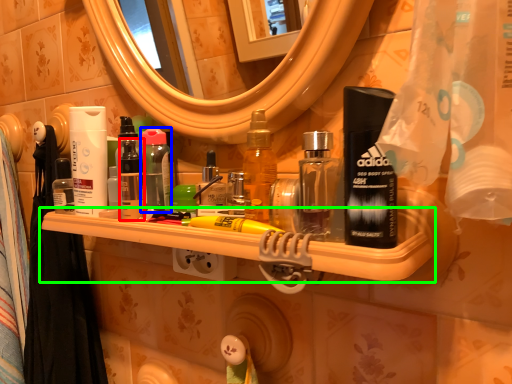
Question: Considering the real-world distances, which object is farthest from toiletry (highlighted by a red box)? mouthwash (highlighted by a blue box) or shelf (highlighted by a green box)?

Choices:
 (A) mouthwash
 (B) shelf

Answer: (B)